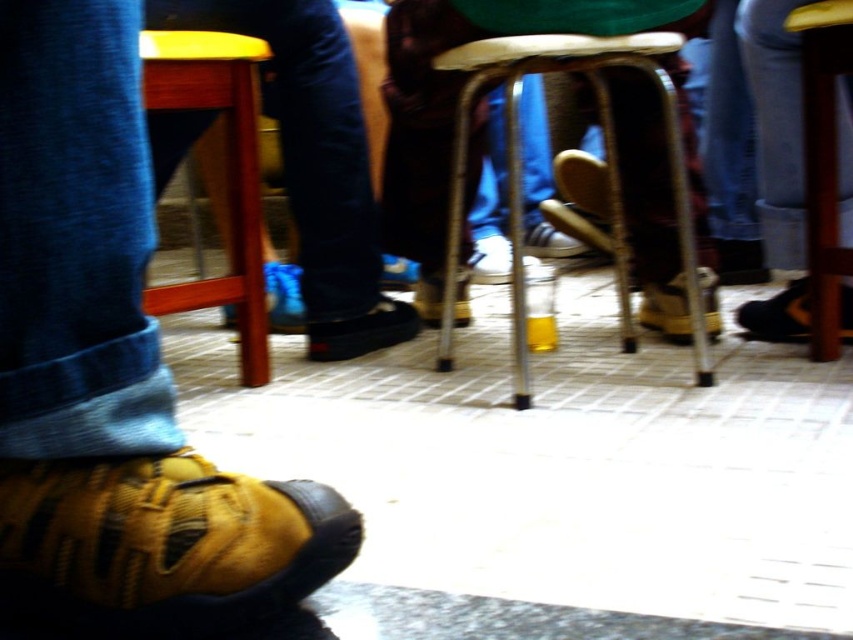
Who is shorter, wooden bar stool at lower left or blue suede shoe at center?

With less height is blue suede shoe at center.

The image size is (853, 640). What do you see at coordinates (218, 173) in the screenshot? I see `wooden bar stool at lower left` at bounding box center [218, 173].

Is point (225, 285) closer to camera compared to point (292, 332)?

Yes.

Image resolution: width=853 pixels, height=640 pixels. Identify the location of wooden bar stool at lower left. (218, 173).

Between yellow fabric shoe at lower left and wooden bar stool at lower left, which one is positioned lower?

yellow fabric shoe at lower left is below.

Between yellow fabric shoe at lower left and wooden bar stool at lower left, which one has more height?

wooden bar stool at lower left

The height and width of the screenshot is (640, 853). I want to click on yellow fabric shoe at lower left, so click(x=163, y=541).

Who is more forward, (73, 148) or (502, 240)?

Point (73, 148)

Between point (154, 584) and point (492, 250), which one is positioned behind?

The point (492, 250) is more distant.

Find the location of a particular element. The image size is (853, 640). leather shoe at lower left is located at coordinates (113, 369).